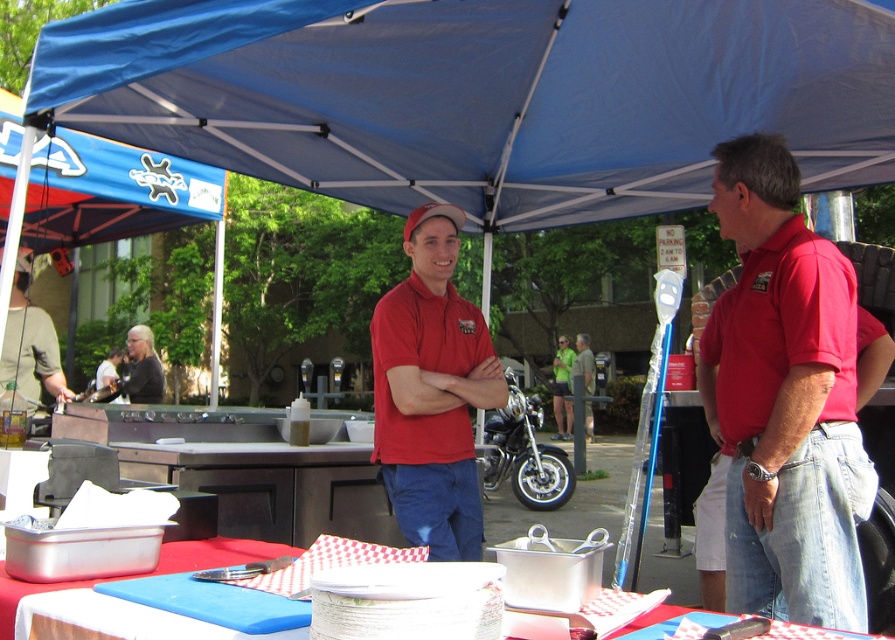
Where is `red cotton polo shirt at center`? The image size is (895, 640). red cotton polo shirt at center is located at coordinates (785, 400).

Does point (824, 385) lie in front of point (214, 561)?

No, it is behind (214, 561).

At what (x,y) coordinates should I click in order to perform the action: click on red cotton polo shirt at center. Please return your answer as a coordinate pair (x, y). Looking at the image, I should click on [x=785, y=400].

Describe the element at coordinates (482, 96) in the screenshot. I see `blue fabric canopy at upper center` at that location.

Can you confirm if blue fabric canopy at upper center is positioned to the right of green matte shirt at left?

Indeed, blue fabric canopy at upper center is positioned on the right side of green matte shirt at left.

What do you see at coordinates (482, 96) in the screenshot? The width and height of the screenshot is (895, 640). I see `blue fabric canopy at upper center` at bounding box center [482, 96].

What are the coordinates of `blue fabric canopy at upper center` in the screenshot? It's located at (482, 96).

Who is taller, matte red polo shirt at center or matte red shirt at center?

matte red polo shirt at center

In the scene shown: Can you confirm if matte red polo shirt at center is taller than matte red shirt at center?

Correct, matte red polo shirt at center is much taller as matte red shirt at center.

Does point (444, 422) lie in front of point (582, 336)?

Yes, it is.

Locate an element on the screen. The height and width of the screenshot is (640, 895). matte red polo shirt at center is located at coordinates (432, 392).